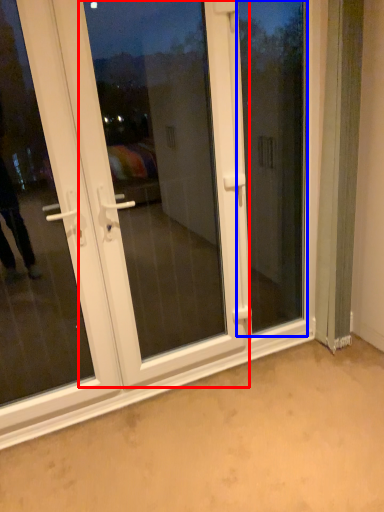
Question: Among these objects, which one is farthest to the camera, screen door (highlighted by a red box) or window screen (highlighted by a blue box)?

Choices:
 (A) screen door
 (B) window screen

Answer: (B)